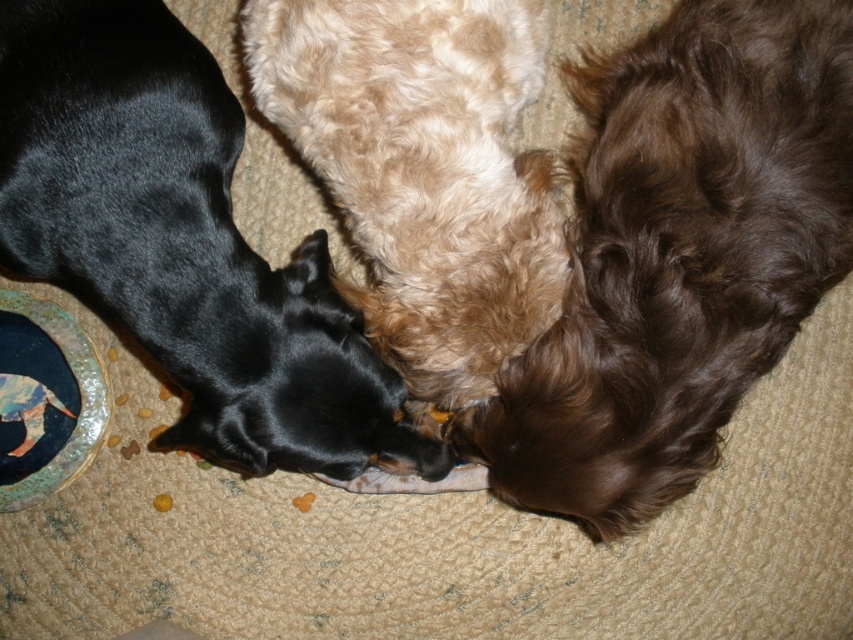
Question: Which point is closer to the camera?

Choices:
 (A) click(389, 35)
 (B) click(646, 60)
 (C) click(0, 228)

Answer: (C)

Question: Estimate the real-world distances between objects in this image. Which object is closer to the black fur dog at left?

Choices:
 (A) fuzzy beige dog at center
 (B) brown curly fur at right

Answer: (A)

Question: Is black fur dog at left further to camera compared to fuzzy beige dog at center?

Choices:
 (A) no
 (B) yes

Answer: (A)

Question: Does brown curly fur at right have a larger size compared to fuzzy beige dog at center?

Choices:
 (A) yes
 (B) no

Answer: (A)

Question: Which object appears closest to the camera in this image?

Choices:
 (A) brown curly fur at right
 (B) fuzzy beige dog at center

Answer: (B)

Question: Is brown curly fur at right positioned before fuzzy beige dog at center?

Choices:
 (A) yes
 (B) no

Answer: (B)